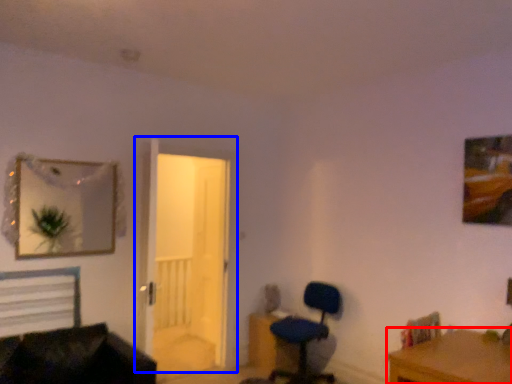
Question: Which point is closer to the camera, desk (highlighted by a red box) or door (highlighted by a blue box)?

Choices:
 (A) desk
 (B) door

Answer: (A)